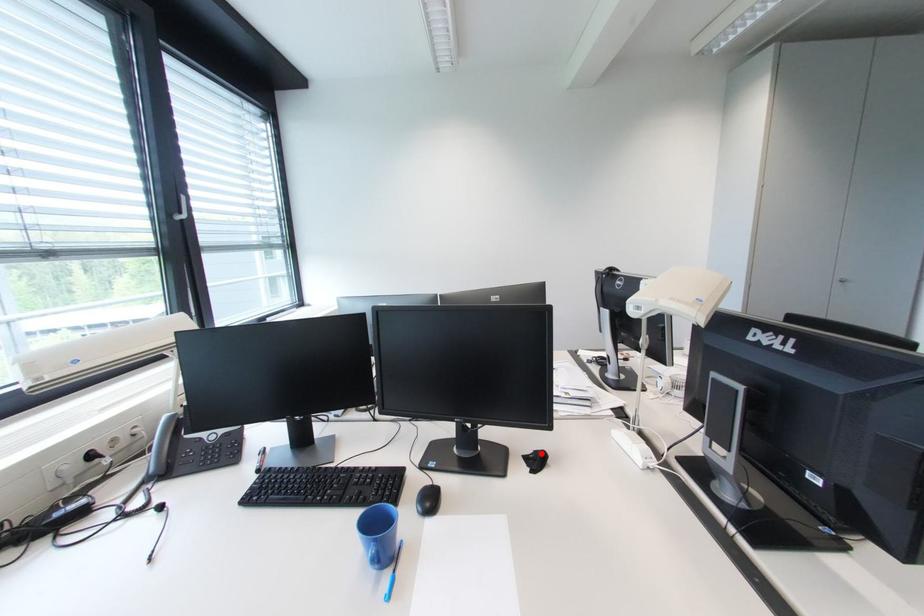
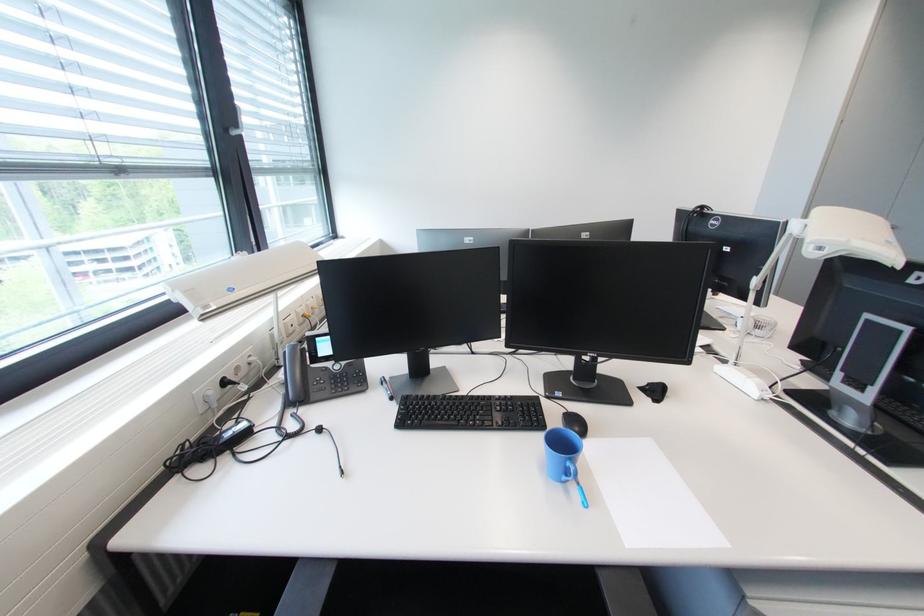
Question: I am providing you with two images of the same scene from different viewpoints. A red point is marked on the first image. Can you still see the location of the red point in image 2?

Choices:
 (A) Yes
 (B) No

Answer: (A)